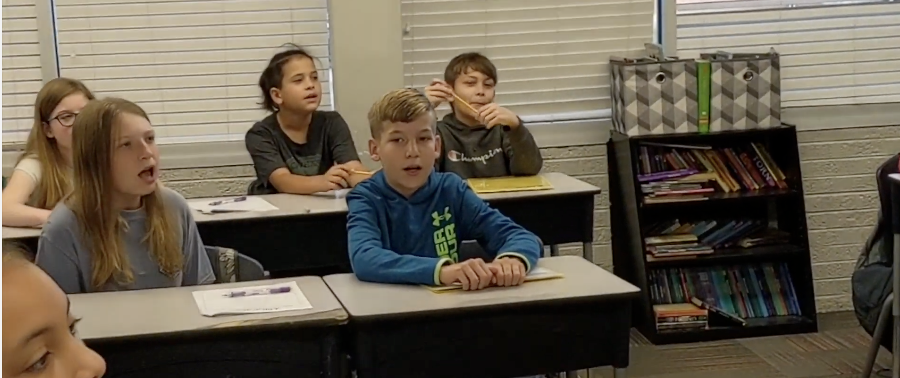
At what (x,y) coordinates should I click in order to perform the action: click on school desk. Please return your answer as a coordinate pair (x, y). Image resolution: width=900 pixels, height=378 pixels. Looking at the image, I should click on (578, 297), (144, 319), (572, 196), (283, 228), (19, 233).